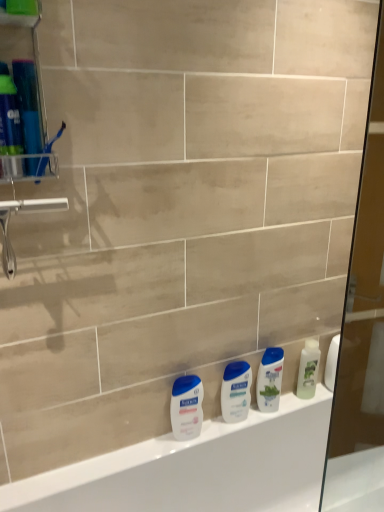
Where is `free location to the left of white glossy lotion at lower center, positioned as the 2th toiletry in right-to-left order`? The width and height of the screenshot is (384, 512). free location to the left of white glossy lotion at lower center, positioned as the 2th toiletry in right-to-left order is located at coordinates (137, 454).